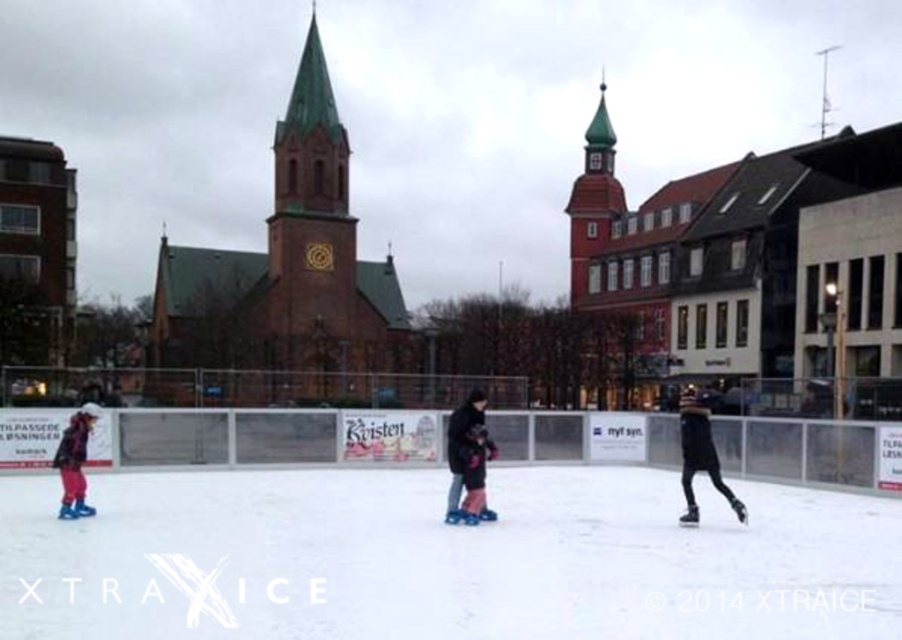
Question: Among these points, which one is nearest to the camera?

Choices:
 (A) (483, 516)
 (B) (79, 424)
 (C) (336, 573)

Answer: (C)

Question: Can you confirm if dark blue fabric jacket at center is smaller than matte pink pants at left?

Choices:
 (A) yes
 (B) no

Answer: (A)

Question: Does white smooth ice at center have a smaller size compared to dark blue fabric jacket at center?

Choices:
 (A) no
 (B) yes

Answer: (A)

Question: Considering the real-world distances, which object is farthest from the dark blue fabric jacket at center?

Choices:
 (A) white smooth ice at center
 (B) matte pink pants at left

Answer: (B)

Question: Does white smooth ice at center have a smaller size compared to dark blue fabric jacket at center?

Choices:
 (A) no
 (B) yes

Answer: (A)

Question: Among these objects, which one is nearest to the camera?

Choices:
 (A) dark blue fabric jacket at center
 (B) matte pink pants at left

Answer: (B)